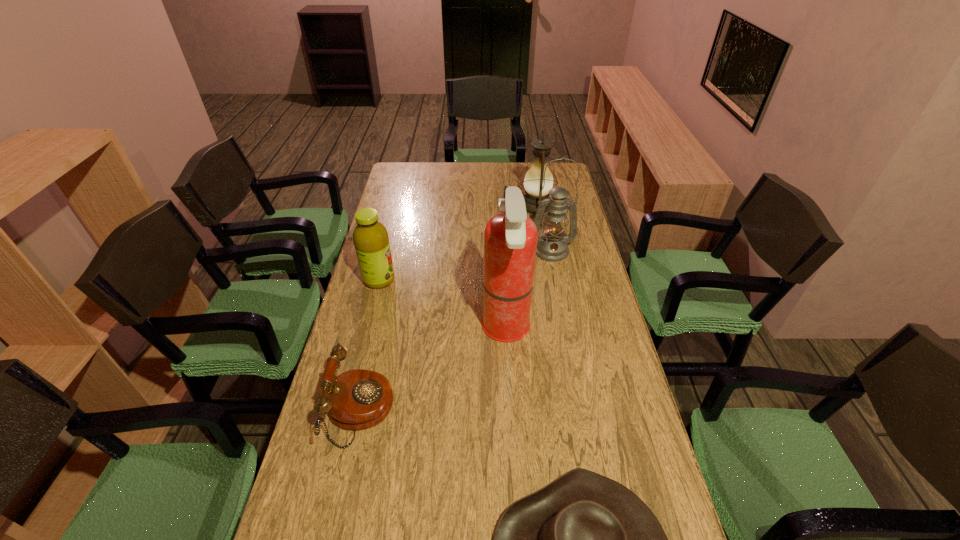
In the image, there is a desktop. Identify the location of vacant space at the far left corner. (419, 177).

Image resolution: width=960 pixels, height=540 pixels. In order to click on empty space between the third farthest object and the second farthest object in this screenshot , I will do [x=466, y=265].

Image resolution: width=960 pixels, height=540 pixels. I want to click on vacant area that lies between the third farthest object and the telephone, so click(x=370, y=345).

Identify the location of free space between the third shortest object and the fifth farthest object. (370, 345).

At what (x,y) coordinates should I click in order to perform the action: click on vacant space that's between the fifth farthest object and the fire extinguisher. Please return your answer as a coordinate pair (x, y). The width and height of the screenshot is (960, 540). Looking at the image, I should click on (433, 370).

Identify the location of object that stands as the closest to the farther oil lamp. This screenshot has height=540, width=960. (552, 246).

Find the location of `the fourth closest object relative to the fifth tallest object`. the fourth closest object relative to the fifth tallest object is located at coordinates (552, 246).

Locate an element on the screen. This screenshot has height=540, width=960. blank area in the image that satisfies the following two spatial constraints: 1. on the front side of the farther oil lamp; 2. on the front label of the fourth nearest object is located at coordinates (548, 280).